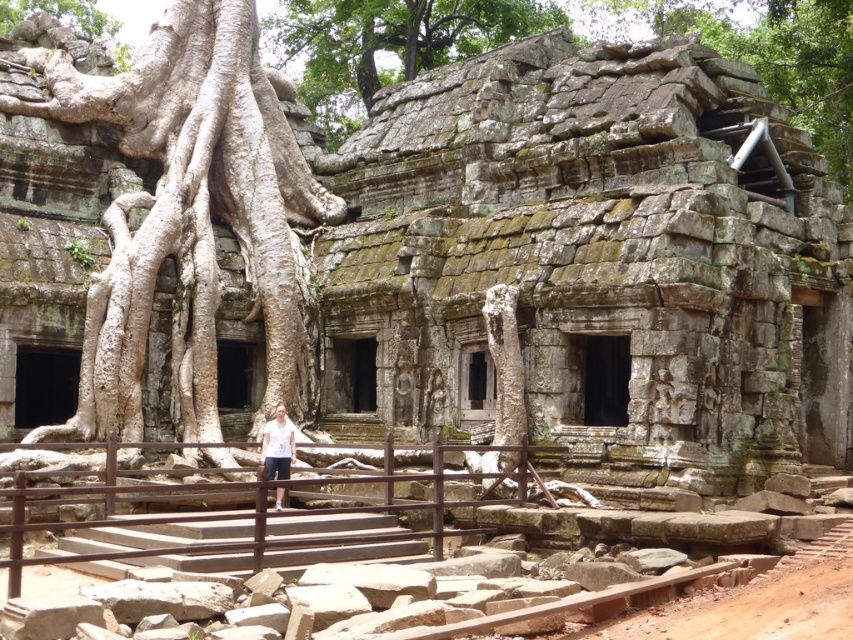
Question: Can you confirm if white rough bark tree at center is wider than green mossy stone wall at upper center?

Choices:
 (A) no
 (B) yes

Answer: (A)

Question: Can you confirm if white rough bark tree at center is wider than white cotton shirt at center?

Choices:
 (A) yes
 (B) no

Answer: (A)

Question: Is green mossy stone wall at upper center thinner than white cotton shirt at center?

Choices:
 (A) yes
 (B) no

Answer: (B)

Question: Estimate the real-world distances between objects in this image. Which object is closer to the green mossy stone wall at upper center?

Choices:
 (A) white cotton shirt at center
 (B) white rough bark tree at center

Answer: (B)

Question: Which of the following is the farthest from the observer?

Choices:
 (A) white cotton shirt at center
 (B) green mossy stone wall at upper center

Answer: (B)

Question: Which of the following is the farthest from the observer?

Choices:
 (A) (308, 365)
 (B) (277, 490)

Answer: (A)